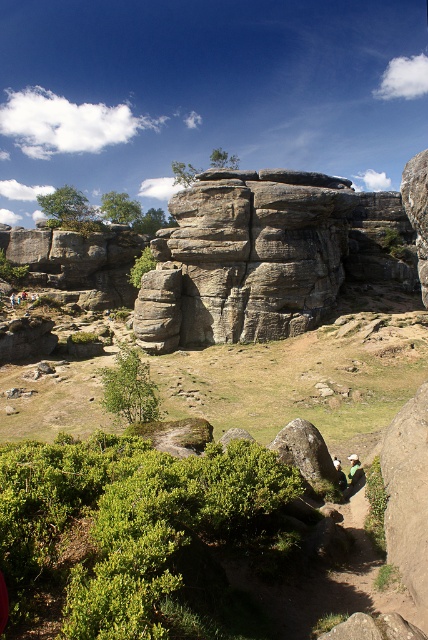
Which is in front, point (219, 362) or point (306, 280)?

Point (219, 362) is more forward.

Is point (321, 328) positioned in front of point (151, 308)?

Yes, point (321, 328) is closer to viewer.

Identify the location of green mossy rock at center. This screenshot has width=428, height=640. (300, 380).

Is gray/rough rock formation at center shorter than green fabric rock climber at lower center?

No, gray/rough rock formation at center is not shorter than green fabric rock climber at lower center.

Is the position of gray/rough rock formation at center less distant than that of green fabric rock climber at lower center?

No.

Who is more forward, [162,237] or [350,481]?

Point [350,481] is more forward.

Identify the location of gray/rough rock formation at center. This screenshot has width=428, height=640. (244, 259).

Which is in front, point (15, 387) or point (356, 476)?

Point (356, 476) is in front.

Measure the distance between green mossy rock at center and green fabric rock climber at lower center.

green mossy rock at center and green fabric rock climber at lower center are 54.00 feet apart.

Is point (201, 371) closer to camera compared to point (348, 456)?

No, it is behind (348, 456).

Identify the location of green mossy rock at center. This screenshot has height=640, width=428. (300, 380).